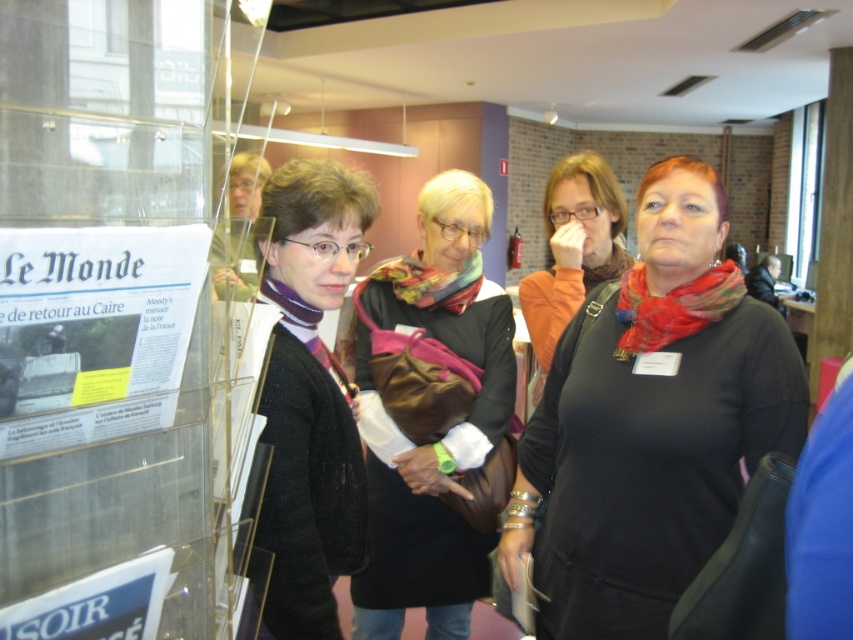
Question: Is matte black shirt at center smaller than matte brown purse at center?

Choices:
 (A) no
 (B) yes

Answer: (B)

Question: Which of the following is the closest to the observer?

Choices:
 (A) blue paper poster at lower left
 (B) black sweater at center
 (C) multicolored knitted scarf at center
 (D) white paper poster at left

Answer: (D)

Question: Which object is farther from the camera taking this photo?

Choices:
 (A) matte black scarf at center
 (B) blue paper poster at lower left
 (C) matte brown purse at center

Answer: (A)

Question: Considering the relative positions of matte black scarf at center and red woven scarf at center in the image provided, where is matte black scarf at center located with respect to red woven scarf at center?

Choices:
 (A) above
 (B) below

Answer: (A)

Question: Estimate the real-world distances between objects in this image. Which object is farther from the matte brown purse at center?

Choices:
 (A) multicolored knitted scarf at center
 (B) white paper poster at left
 (C) matte black shirt at center
 (D) red woven scarf at center

Answer: (B)

Question: Can you confirm if black sweater at center is positioned to the left of red woven scarf at center?

Choices:
 (A) yes
 (B) no

Answer: (A)